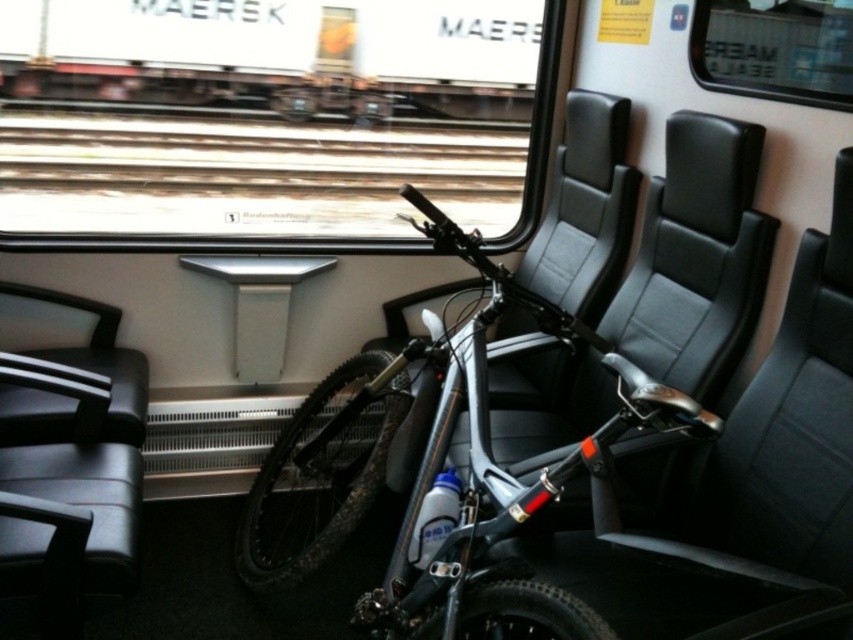
Question: Can you confirm if silver metallic bicycle at center is positioned below black leather chair at left?

Choices:
 (A) yes
 (B) no

Answer: (B)

Question: Among these objects, which one is nearest to the camera?

Choices:
 (A) silver metallic bicycle at center
 (B) transparent glass window at upper center

Answer: (B)

Question: Which object is positioned closest to the black leather chair at center?

Choices:
 (A) transparent glass window at upper center
 (B) black leather chair at left
 (C) silver metallic bicycle at center

Answer: (A)

Question: Estimate the real-world distances between objects in this image. Which object is farther from the black leather chair at left?

Choices:
 (A) silver metallic bicycle at center
 (B) black leather chair at center

Answer: (B)

Question: Does black leather chair at left appear on the right side of transparent glass window at upper center?

Choices:
 (A) no
 (B) yes

Answer: (A)

Question: Is black leather chair at left bigger than transparent glass window at upper center?

Choices:
 (A) no
 (B) yes

Answer: (B)